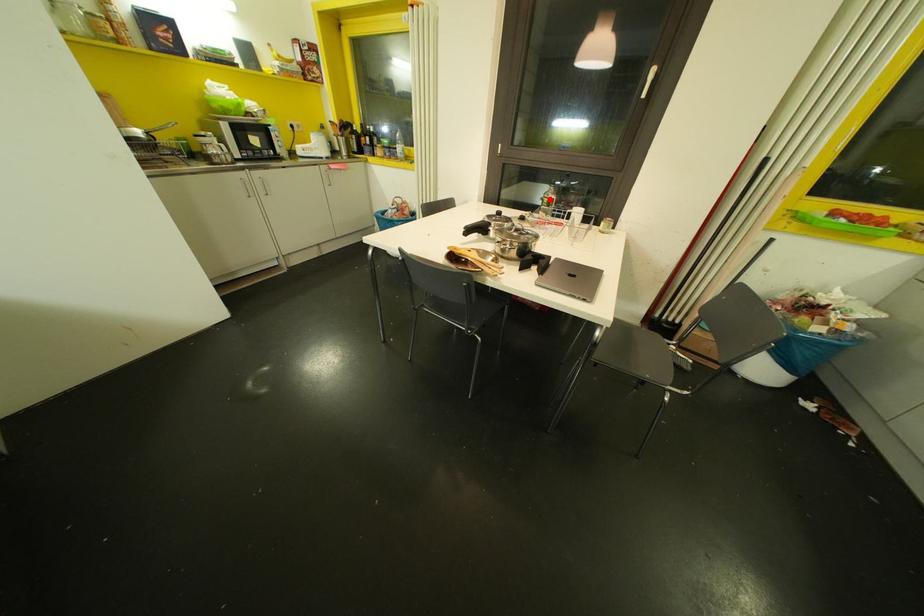
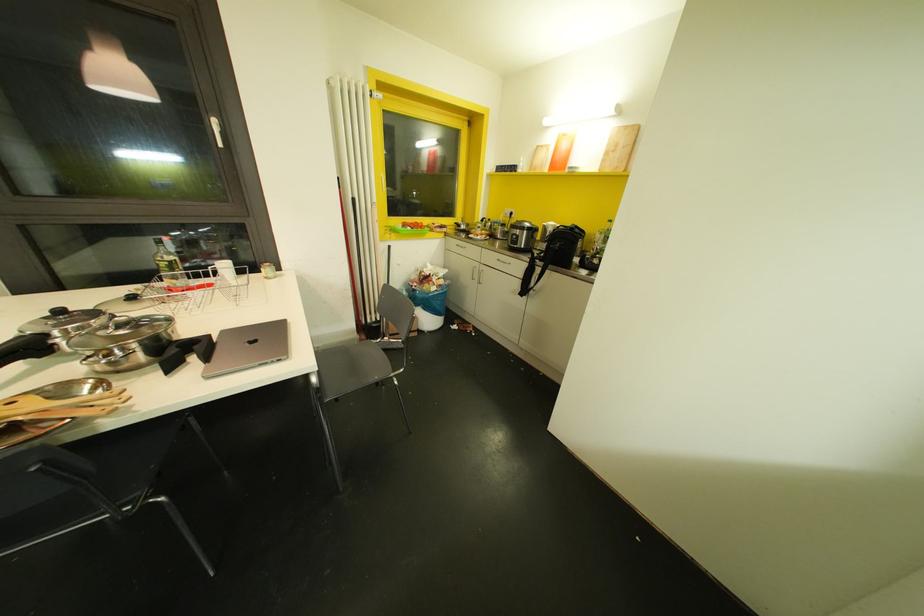
Question: I am providing you with two images of the same scene from different viewpoints. In image1, a red point is highlighted. Considering the same 3D point in image2, which of the following is correct?

Choices:
 (A) It is closer
 (B) It is farther

Answer: (B)